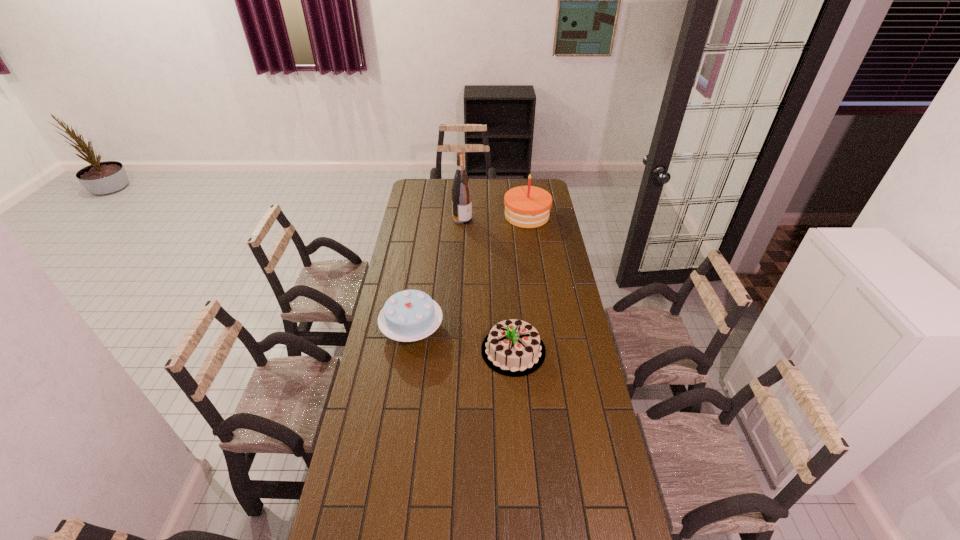
You are a GUI agent. You are given a task and a screenshot of the screen. Output one action in this format:
    pyautogui.click(x=<x>, y=<y>)
    Task: Click on the vacant space at the far edge
    The width and height of the screenshot is (960, 540).
    Given the screenshot: What is the action you would take?
    pyautogui.click(x=452, y=181)

The width and height of the screenshot is (960, 540). Identify the location of blank area at the left edge. (359, 539).

Where is `blank space at the right edge of the desktop`? This screenshot has width=960, height=540. blank space at the right edge of the desktop is located at coordinates (591, 455).

Find the location of a particular element. vacant space at the far right corner is located at coordinates (527, 185).

This screenshot has height=540, width=960. I want to click on vacant point located between the tallest birthday cake and the second object from left to right, so click(x=494, y=218).

Image resolution: width=960 pixels, height=540 pixels. In order to click on unoccupied area between the leftmost birthday cake and the farthest birthday cake in this screenshot , I will do `click(469, 272)`.

Locate an element on the screen. unoccupied position between the leftmost object and the second object from left to right is located at coordinates (437, 274).

The width and height of the screenshot is (960, 540). I want to click on empty location between the leftmost birthday cake and the tallest birthday cake, so click(x=469, y=272).

I want to click on empty space between the leftmost object and the third shortest object, so click(469, 272).

This screenshot has height=540, width=960. I want to click on free spot between the farthest birthday cake and the leftmost birthday cake, so pyautogui.click(x=469, y=272).